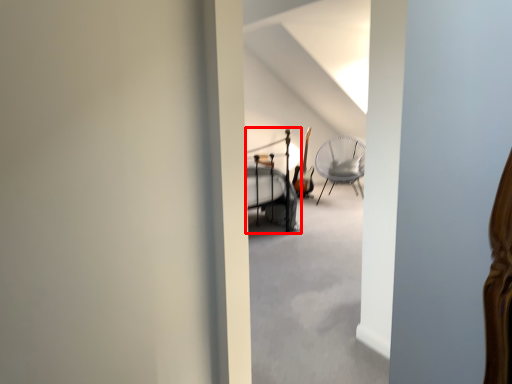
Question: In this image, where is bunk bed (annotated by the red box) located relative to chair?

Choices:
 (A) left
 (B) right

Answer: (A)